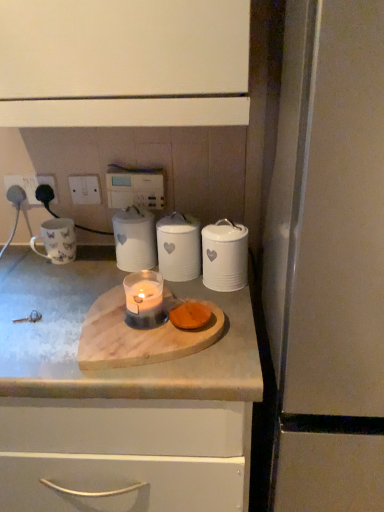
You are a GUI agent. You are given a task and a screenshot of the screen. Output one action in this format:
    pyautogui.click(x=<x>, y=<y>)
    Task: Click on the matte white mug at left
    
    Given the screenshot: What is the action you would take?
    pyautogui.click(x=57, y=240)

The width and height of the screenshot is (384, 512). I want to click on translucent glass candle at center, so click(144, 300).

What do you see at coordinates (224, 256) in the screenshot?
I see `white ceramic canister at right, the 1th kitchen appliance in the right-to-left sequence` at bounding box center [224, 256].

Measure the distance between point (175,230) and camera.

A distance of 1.00 meters exists between point (175,230) and camera.

Image resolution: width=384 pixels, height=512 pixels. I want to click on white glossy electric outlet at upper left, arranged as the 2th electric outlet when viewed from the left, so click(48, 183).

Where is `matte white mug at left`? matte white mug at left is located at coordinates (57, 240).

From the image's perspective, which one is positioned higher, white glossy electric outlet at upper left, arranged as the 2th electric outlet when viewed from the left, or translucent glass candle at center?

white glossy electric outlet at upper left, arranged as the 2th electric outlet when viewed from the left.

Is white glossy electric outlet at upper left, which is the second electric outlet from right to left, directly adjacent to translucent glass candle at center?

→ No, white glossy electric outlet at upper left, which is the second electric outlet from right to left, is not in contact with translucent glass candle at center.

This screenshot has width=384, height=512. Identify the location of candle holder on the right of white glossy electric outlet at upper left, arranged as the 2th electric outlet when viewed from the left. (144, 300).

In the image, is white glossy electric outlet at upper left, arranged as the 2th electric outlet when viewed from the left, positioned in front of or behind translucent glass candle at center?

white glossy electric outlet at upper left, arranged as the 2th electric outlet when viewed from the left, is behind translucent glass candle at center.

In the scene shown: Is white plastic socket at upper left, which is the 1th electric outlet in left-to-right order, positioned beyond the bounds of white ceramic canister at center, marked as the 2th kitchen appliance in a left-to-right arrangement?

Yes.

Is white plastic socket at upper left, arranged as the third electric outlet when viewed from the right, positioned far away from white ceramic canister at center, the second kitchen appliance from the right?

They are positioned close to each other.

Is white plastic socket at upper left, arranged as the third electric outlet when viewed from the right, oriented away from white ceramic canister at center, marked as the 2th kitchen appliance in a left-to-right arrangement?

No, white plastic socket at upper left, arranged as the third electric outlet when viewed from the right, is not facing away from white ceramic canister at center, marked as the 2th kitchen appliance in a left-to-right arrangement.

Can you confirm if white ceramic canister at center, the second kitchen appliance from the right, is bigger than white plastic socket at upper left, arranged as the third electric outlet when viewed from the right?

Yes, white ceramic canister at center, the second kitchen appliance from the right, is bigger than white plastic socket at upper left, arranged as the third electric outlet when viewed from the right.

From a real-world perspective, who is located lower, white ceramic canister at center, the second kitchen appliance from the right, or white plastic socket at upper left, which is the 1th electric outlet in left-to-right order?

white ceramic canister at center, the second kitchen appliance from the right, from a real-world perspective.

Who is shorter, white ceramic canister at center, marked as the 2th kitchen appliance in a left-to-right arrangement, or white plastic socket at upper left, arranged as the third electric outlet when viewed from the right?

white plastic socket at upper left, arranged as the third electric outlet when viewed from the right, is shorter.

In the image, is white ceramic canister at center, the second kitchen appliance from the right, on the left side or the right side of white plastic socket at upper left, which is the 1th electric outlet in left-to-right order?

white ceramic canister at center, the second kitchen appliance from the right, is positioned on white plastic socket at upper left, which is the 1th electric outlet in left-to-right order,'s right side.

From a real-world perspective, does translucent glass candle at center stand above wooden cutting board at center?

Correct, in the physical world, translucent glass candle at center is higher than wooden cutting board at center.

Is translucent glass candle at center not close to wooden cutting board at center?

That's not correct — translucent glass candle at center is a little close to wooden cutting board at center.

Considering the relative positions of translucent glass candle at center and wooden cutting board at center in the image provided, is translucent glass candle at center to the left of wooden cutting board at center from the viewer's perspective?

Incorrect, translucent glass candle at center is not on the left side of wooden cutting board at center.

Considering the points (150, 287) and (92, 279), which point is behind, point (150, 287) or point (92, 279)?

Positioned behind is point (92, 279).

From a real-world perspective, does white glossy electric outlet at upper left, arranged as the 2th electric outlet when viewed from the left, sit lower than white ceramic canister at center, the second kitchen appliance from the right?

No, from a real-world perspective, white glossy electric outlet at upper left, arranged as the 2th electric outlet when viewed from the left, is not under white ceramic canister at center, the second kitchen appliance from the right.

Are white glossy electric outlet at upper left, arranged as the 2th electric outlet when viewed from the left, and white ceramic canister at center, marked as the 2th kitchen appliance in a left-to-right arrangement, located far from each other?

Result: white glossy electric outlet at upper left, arranged as the 2th electric outlet when viewed from the left, is actually quite close to white ceramic canister at center, marked as the 2th kitchen appliance in a left-to-right arrangement.

Is point (45, 178) positioned before point (184, 260)?

No.

Considering the sizes of white glossy electric outlet at upper left, arranged as the 2th electric outlet when viewed from the left, and white ceramic canister at center, marked as the 2th kitchen appliance in a left-to-right arrangement, in the image, is white glossy electric outlet at upper left, arranged as the 2th electric outlet when viewed from the left, wider or thinner than white ceramic canister at center, marked as the 2th kitchen appliance in a left-to-right arrangement,?

white glossy electric outlet at upper left, arranged as the 2th electric outlet when viewed from the left, is thinner than white ceramic canister at center, marked as the 2th kitchen appliance in a left-to-right arrangement.

Between point (40, 386) and point (46, 178), which one is positioned in front?

The point (40, 386) is closer to the camera.

Does wooden cutting board at center turn towards white plastic socket at upper left, which is the 1th electric outlet in left-to-right order?

No.

Relative to white plastic socket at upper left, arranged as the third electric outlet when viewed from the right, is wooden cutting board at center in front or behind?

In the image, wooden cutting board at center appears in front of white plastic socket at upper left, arranged as the third electric outlet when viewed from the right.

Between wooden cutting board at center and white plastic socket at upper left, arranged as the third electric outlet when viewed from the right, which one has more height?

Standing taller between the two is white plastic socket at upper left, arranged as the third electric outlet when viewed from the right.

Which is more to the right, white ceramic canister at center, the second kitchen appliance from the right, or white ceramic canister at right, the 1th kitchen appliance in the right-to-left sequence?

white ceramic canister at right, the 1th kitchen appliance in the right-to-left sequence.

Consider the image. From the image's perspective, is white ceramic canister at center, the second kitchen appliance from the right, above white ceramic canister at right, the 3th kitchen appliance when ordered from left to right?

Indeed, from the image's perspective, white ceramic canister at center, the second kitchen appliance from the right, is shown above white ceramic canister at right, the 3th kitchen appliance when ordered from left to right.

From a real-world perspective, is white ceramic canister at center, the second kitchen appliance from the right, on white ceramic canister at right, the 3th kitchen appliance when ordered from left to right?

Actually, white ceramic canister at center, the second kitchen appliance from the right, is physically below white ceramic canister at right, the 3th kitchen appliance when ordered from left to right, in the real world.

Is white ceramic canister at center, the second kitchen appliance from the right, wider than white ceramic canister at right, the 3th kitchen appliance when ordered from left to right?

Correct, the width of white ceramic canister at center, the second kitchen appliance from the right, exceeds that of white ceramic canister at right, the 3th kitchen appliance when ordered from left to right.

This screenshot has height=512, width=384. I want to click on the 1st electric outlet directly above the translucent glass candle at center (from a real-world perspective), so click(x=48, y=183).

From a real-world perspective, starting from the white plastic socket at upper left, which is the 1th electric outlet in left-to-right order, which kitchen appliance is the 3rd one below it? Please provide its 2D coordinates.

[(178, 247)]

Considering their positions, is white plastic socket at upper left, arranged as the third electric outlet when viewed from the right, positioned closer to wooden cutting board at center than white ceramic canister at center, the second kitchen appliance from the right?

Based on the image, white ceramic canister at center, the second kitchen appliance from the right, appears to be nearer to wooden cutting board at center.

Estimate the real-world distances between objects in this image. Which object is further from translucent glass candle at center, white glossy electric outlet at upper left, which is the second electric outlet from right to left, or white ceramic canister at center, marked as the 2th kitchen appliance in a left-to-right arrangement?

Based on the image, white glossy electric outlet at upper left, which is the second electric outlet from right to left, appears to be further to translucent glass candle at center.

Looking at the image, which one is located closer to white ceramic canister at center, the 1th kitchen appliance viewed from the left, white plastic electric outlet at upper left, which ranks as the 1th electric outlet in right-to-left order, or wooden cutting board at center?

Based on the image, white plastic electric outlet at upper left, which ranks as the 1th electric outlet in right-to-left order, appears to be nearer to white ceramic canister at center, the 1th kitchen appliance viewed from the left.

Based on the photo, from the image, which object appears to be nearer to white plastic electric outlet at upper left, the 3th electric outlet in the left-to-right sequence, translucent glass candle at center or white plastic socket at upper left, arranged as the third electric outlet when viewed from the right?

white plastic socket at upper left, arranged as the third electric outlet when viewed from the right.

Based on their spatial positions, is white plastic electric outlet at upper left, the 3th electric outlet in the left-to-right sequence, or white ceramic canister at center, the 3th kitchen appliance from the right, closer to translucent glass candle at center?

white ceramic canister at center, the 3th kitchen appliance from the right, lies closer to translucent glass candle at center than the other object.

Which object lies further to the anchor point wooden cutting board at center, white ceramic canister at center, the second kitchen appliance from the right, or matte white mug at left?

matte white mug at left.

Estimate the real-world distances between objects in this image. Which object is further from white ceramic canister at right, the 1th kitchen appliance in the right-to-left sequence, white plastic socket at upper left, which is the 1th electric outlet in left-to-right order, or wooden cutting board at center?

Among the two, white plastic socket at upper left, which is the 1th electric outlet in left-to-right order, is located further to white ceramic canister at right, the 1th kitchen appliance in the right-to-left sequence.

Which object lies nearer to the anchor point white ceramic canister at center, marked as the 2th kitchen appliance in a left-to-right arrangement, white plastic socket at upper left, arranged as the third electric outlet when viewed from the right, or translucent glass candle at center?

translucent glass candle at center.

The height and width of the screenshot is (512, 384). I want to click on candle holder between matte white mug at left and white ceramic canister at center, marked as the 2th kitchen appliance in a left-to-right arrangement, so click(x=144, y=300).

Where is `candle holder located between wooden cutting board at center and white plastic electric outlet at upper left, which ranks as the 1th electric outlet in right-to-left order, in the depth direction`? The height and width of the screenshot is (512, 384). candle holder located between wooden cutting board at center and white plastic electric outlet at upper left, which ranks as the 1th electric outlet in right-to-left order, in the depth direction is located at coordinates (144, 300).

You are a GUI agent. You are given a task and a screenshot of the screen. Output one action in this format:
    pyautogui.click(x=<x>, y=<y>)
    Task: Click on the candle holder positioned between wooden cutting board at center and matte white mug at left from near to far
    This screenshot has height=512, width=384.
    Given the screenshot: What is the action you would take?
    pyautogui.click(x=144, y=300)

Find the location of `candle holder between wooden cutting board at center and white glossy electric outlet at upper left, arranged as the 2th electric outlet when viewed from the left, from front to back`. candle holder between wooden cutting board at center and white glossy electric outlet at upper left, arranged as the 2th electric outlet when viewed from the left, from front to back is located at coordinates (144, 300).